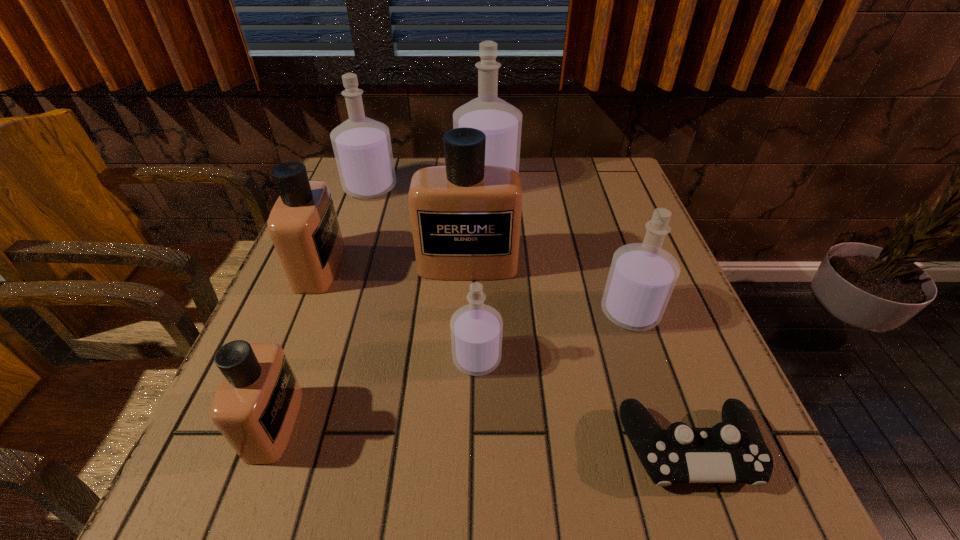
The height and width of the screenshot is (540, 960). I want to click on the biggest purple perfume, so click(x=501, y=122).

Identify the location of the tallest object. (501, 122).

At what (x,y) coordinates should I click in order to perform the action: click on the leftmost purple perfume. Please return your answer as a coordinate pair (x, y). Looking at the image, I should click on (362, 147).

Where is `the biggest beige perfume`? Image resolution: width=960 pixels, height=540 pixels. the biggest beige perfume is located at coordinates (466, 216).

Identify the location of the third farthest purple perfume. This screenshot has height=540, width=960. (642, 276).

At what (x,y) coordinates should I click in order to perform the action: click on the second smallest purple perfume. Please return your answer as a coordinate pair (x, y). Looking at the image, I should click on (642, 276).

Locate an element on the screen. the second biggest beige perfume is located at coordinates (303, 225).

The width and height of the screenshot is (960, 540). What are the coordinates of `the smallest purple perfume` in the screenshot? It's located at (476, 329).

At what (x,y) coordinates should I click in order to perform the action: click on the third nearest object. Please return your answer as a coordinate pair (x, y). This screenshot has width=960, height=540. Looking at the image, I should click on (476, 329).

Identify the location of the nearest beige perfume. (255, 408).